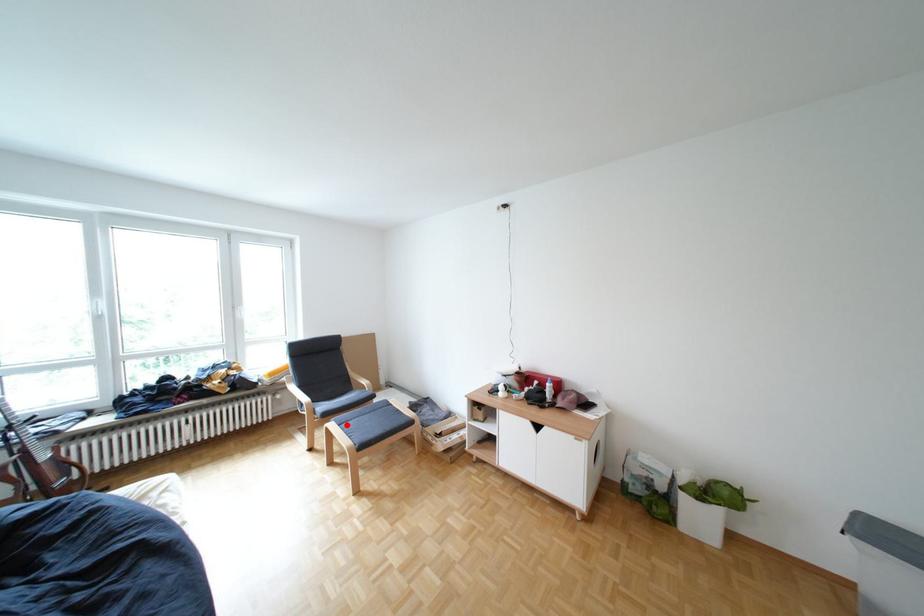
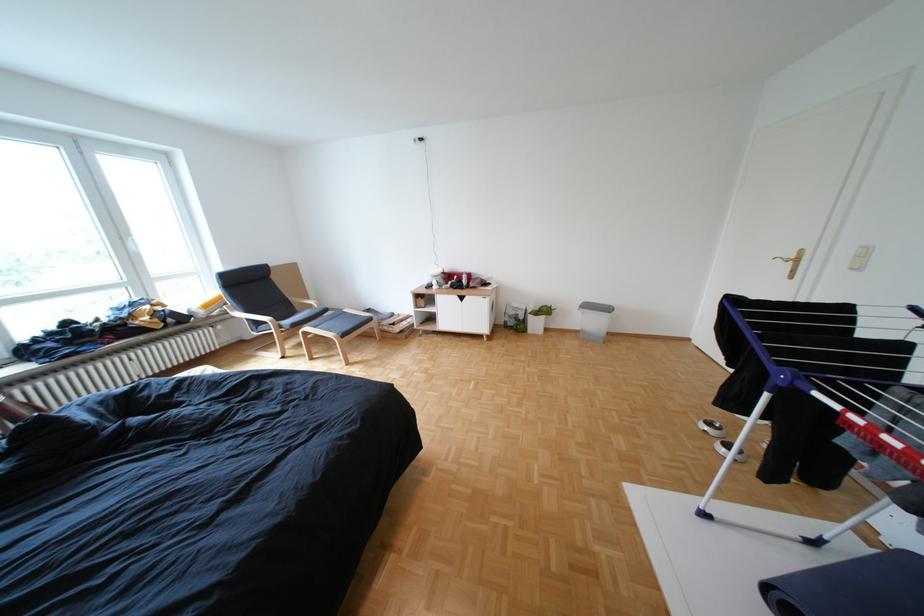
Question: I am providing you with two images of the same scene from different viewpoints. A red point is marked on the first image. Is the red point's position out of view in image 2?

Choices:
 (A) Yes
 (B) No

Answer: (B)